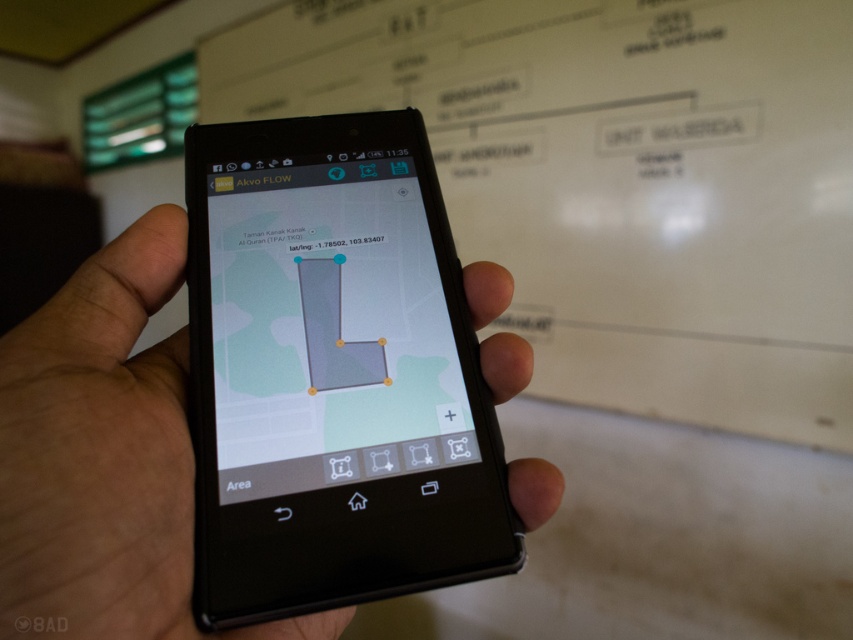
You are trying to determine if the two phones in the scene can fit side by side on a desk that is 30 cm wide. The black matte phone at center and the matte black phone at center are both placed horizontally. Can both fit without overlapping?

The black matte phone at center is wider than the matte black phone at center. If their combined widths are less than or equal to 30 cm, they can fit. However, since the exact widths aren

You are a technician holding a 6.5 cm wide tool and need to place it next to the black matte phone at center and the matte black phone at center. Can the tool fit between them without overlapping either phone?

The black matte phone at center and the matte black phone at center are 6.70 centimeters apart. Since the tool is 6.5 cm wide, it can fit between them as the distance between the phones is slightly larger than the tool.

You are using the Akvo FLOW app on your smartphone to measure distances between two points. The app shows a point at coordinates (167, 589). If the screen diagonal is 15 cm, how far apart are the two points in centimeters?

The two points are 39.17 centimeters apart.